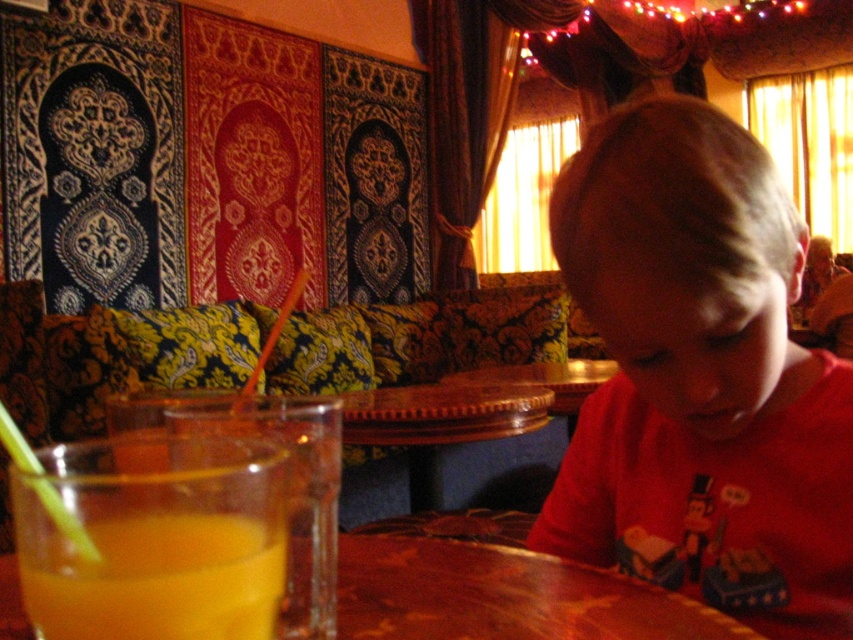
Question: Is yellow translucent liquid at lower left thinner than wooden table at center?

Choices:
 (A) no
 (B) yes

Answer: (B)

Question: Can you confirm if red matte shirt at lower right is positioned to the left of yellow translucent liquid at lower left?

Choices:
 (A) no
 (B) yes

Answer: (A)

Question: Which point appears closest to the camera in this image?

Choices:
 (A) (682, 506)
 (B) (0, 572)

Answer: (B)

Question: From the image, what is the correct spatial relationship of yellow translucent liquid at lower left in relation to wooden table at center?

Choices:
 (A) below
 (B) above

Answer: (B)

Question: Which point is farther to the camera?

Choices:
 (A) (397, 570)
 (B) (590, 291)

Answer: (A)

Question: Based on their relative distances, which object is farther from the wooden table at center?

Choices:
 (A) red matte shirt at lower right
 (B) yellow translucent liquid at lower left

Answer: (B)